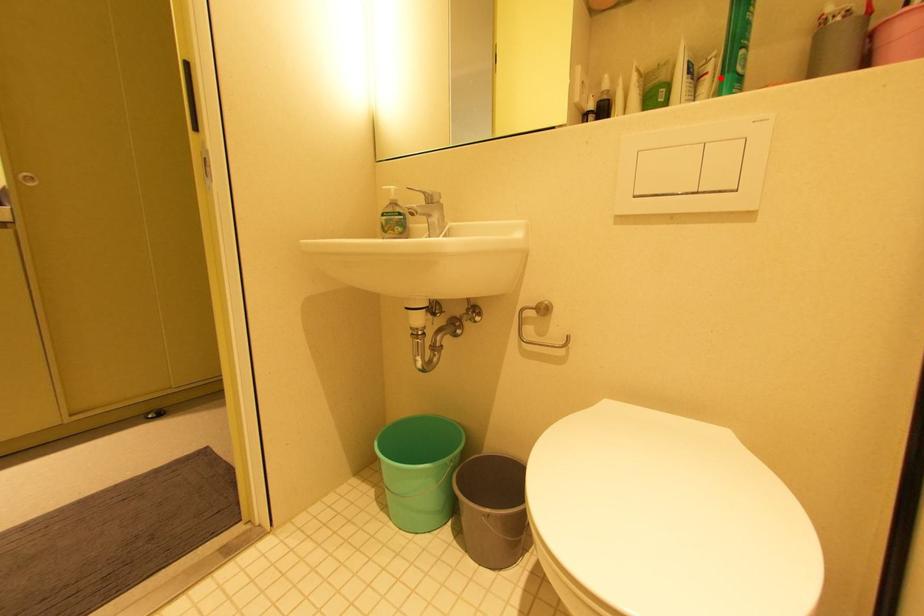
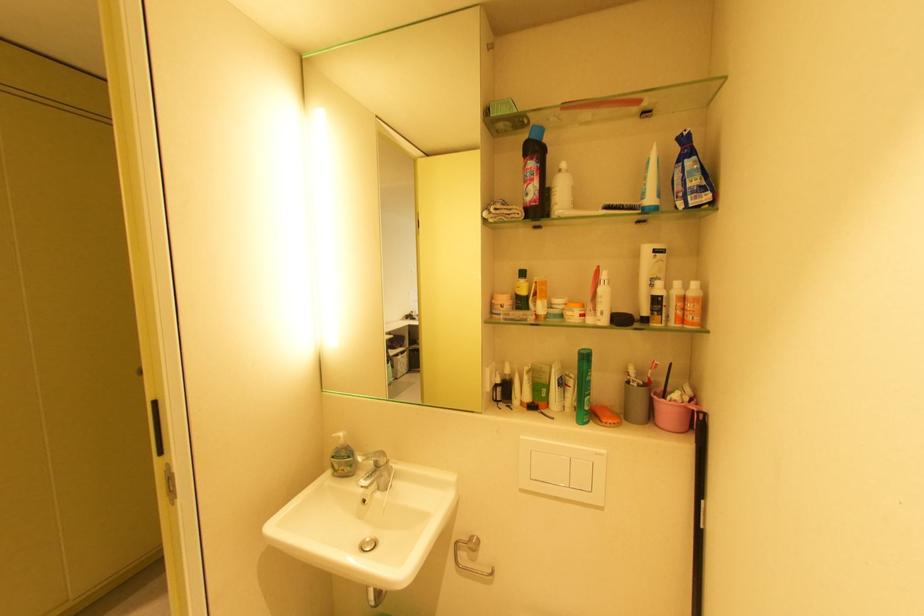
The point at the highlighted location is marked in the first image. Where is the corresponding point in the second image?

(580, 392)